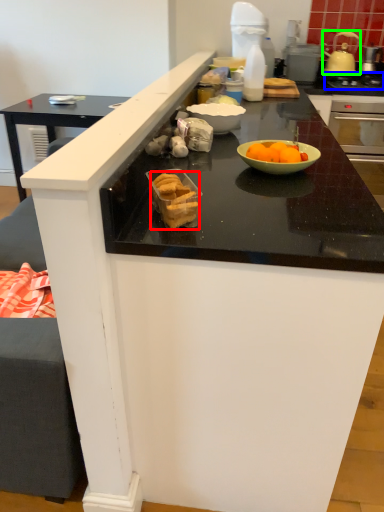
Question: Which is nearer to the food (highlighted by a red box)? gas stove (highlighted by a blue box) or kitchen appliance (highlighted by a green box).

Choices:
 (A) gas stove
 (B) kitchen appliance

Answer: (A)